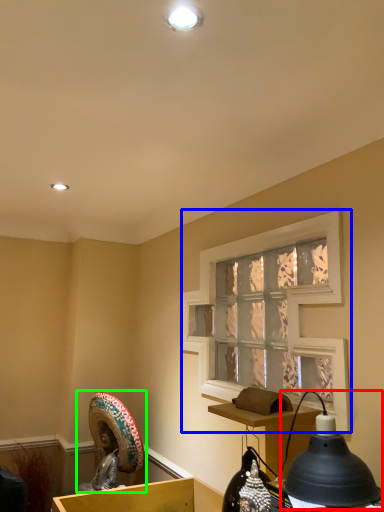
Question: Based on their relative distances, which object is farther from lamp (highlighted by a red box)? Choose from window screen (highlighted by a blue box) and sculpture (highlighted by a green box).

Choices:
 (A) window screen
 (B) sculpture

Answer: (B)